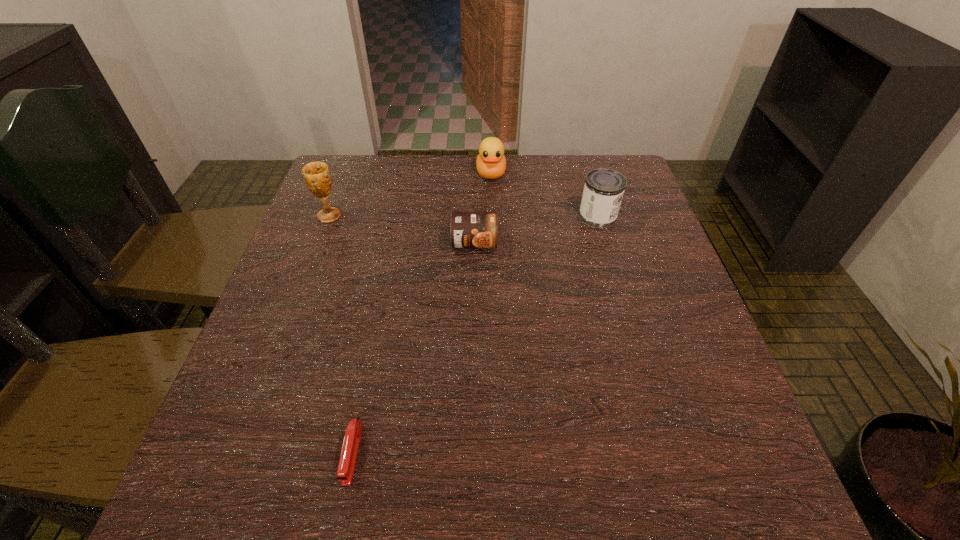
I want to click on chalice, so click(316, 174).

Find the location of a particular element. The image size is (960, 540). the tallest object is located at coordinates (316, 174).

Find the location of `duckling`. duckling is located at coordinates (491, 163).

At what (x,y) coordinates should I click in order to perform the action: click on the taller can. Please return your answer as a coordinate pair (x, y). Looking at the image, I should click on (604, 188).

The width and height of the screenshot is (960, 540). Find the location of `the rightmost object`. the rightmost object is located at coordinates (604, 188).

Image resolution: width=960 pixels, height=540 pixels. In order to click on the nearer can in this screenshot , I will do `click(468, 229)`.

Find the location of a particular element. the shorter can is located at coordinates (468, 229).

Identify the location of the nearest object. The image size is (960, 540). (347, 461).

I want to click on the fourth object from right to left, so click(347, 461).

Locate an element on the screen. This screenshot has width=960, height=540. vacant space located 0.080m on the front of the chalice is located at coordinates (319, 245).